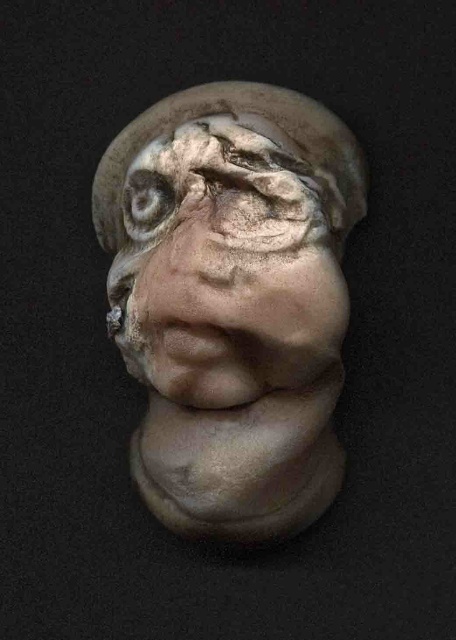
Question: Which point appears farthest from the camera in this image?

Choices:
 (A) [x=271, y=195]
 (B) [x=217, y=195]

Answer: (B)

Question: In this image, where is matte clay bust at center located relative to matte clay eye at center?

Choices:
 (A) left
 (B) right

Answer: (B)

Question: Is matte clay bust at center positioned before matte clay eye at center?

Choices:
 (A) yes
 (B) no

Answer: (A)

Question: Which of the following is the closest to the observer?

Choices:
 (A) click(x=247, y=460)
 (B) click(x=233, y=173)

Answer: (B)

Question: Does matte clay bust at center have a lesser width compared to matte clay eye at center?

Choices:
 (A) yes
 (B) no

Answer: (B)

Question: Which object appears farthest from the camera in this image?

Choices:
 (A) matte clay eye at center
 (B) matte clay bust at center

Answer: (A)